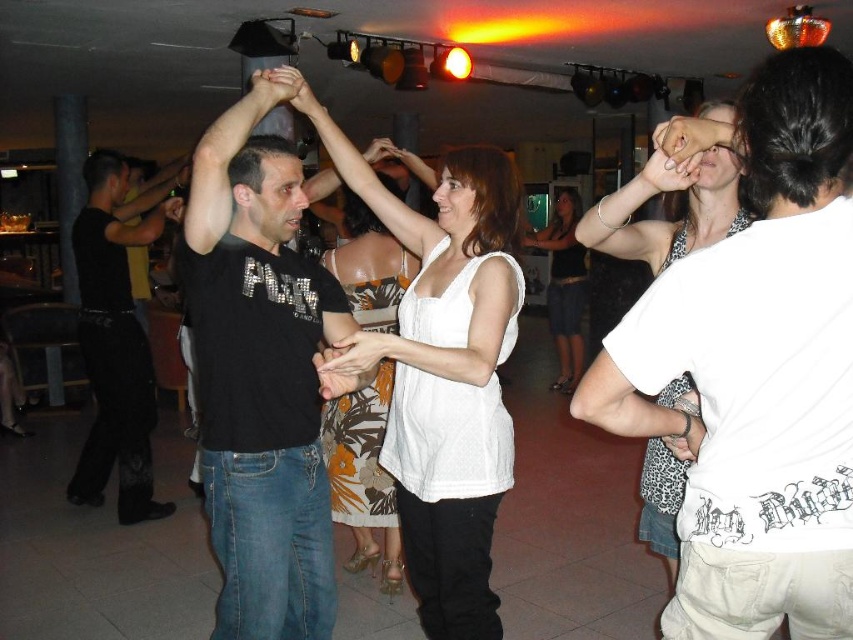
You are a photographer trying to capture a candid shot of the two dancers in the scene. You notice the black smooth pants at left and the white fabric dress at center. Which one is closer to the camera based on their positions?

The black smooth pants at left is positioned under the white fabric dress at center, which means it is closer to the camera.

You are a photographer at the dance scene. You need to capture a photo where the black smooth pants at left and the white matte tank top at center are both visible. Based on their positions, which one will appear higher in the photo?

The black smooth pants at left will appear higher in the photo because it is located above the white matte tank top at center.